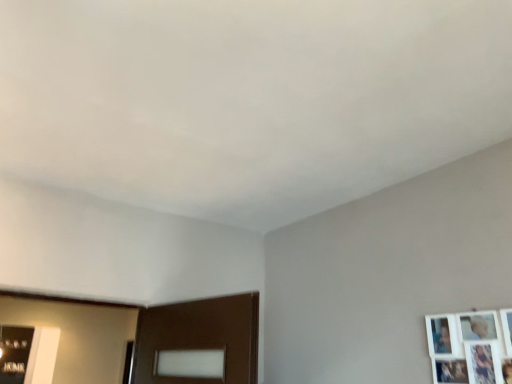
Question: In terms of height, does metallic silver picture frame at lower left, which appears as the second picture frame when viewed from the right, look taller or shorter compared to white matte picture frame at upper right, placed as the second picture frame when sorted from bottom to top?

Choices:
 (A) short
 (B) tall

Answer: (B)

Question: From a real-world perspective, relative to white matte picture frame at upper right, which is the first picture frame in top-to-bottom order, is metallic silver picture frame at lower left, which appears as the second picture frame when viewed from the right, vertically above or below?

Choices:
 (A) below
 (B) above

Answer: (B)

Question: Considering the positions of point [27, 349] and point [468, 334], is point [27, 349] closer or farther from the camera than point [468, 334]?

Choices:
 (A) closer
 (B) farther

Answer: (B)

Question: Is white matte picture frame at upper right, which ranks as the second picture frame in left-to-right order, taller or shorter than metallic silver picture frame at lower left, arranged as the second picture frame when viewed from the top?

Choices:
 (A) tall
 (B) short

Answer: (B)

Question: Based on their positions, is white matte picture frame at upper right, placed as the second picture frame when sorted from bottom to top, located to the left or right of metallic silver picture frame at lower left, marked as the second picture frame in a front-to-back arrangement?

Choices:
 (A) right
 (B) left

Answer: (A)

Question: Is point tap(451, 365) positioned closer to the camera than point tap(18, 337)?

Choices:
 (A) closer
 (B) farther

Answer: (A)

Question: Is white matte picture frame at upper right, which ranks as the first picture frame in right-to-left order, bigger or smaller than metallic silver picture frame at lower left, arranged as the second picture frame when viewed from the top?

Choices:
 (A) big
 (B) small

Answer: (B)